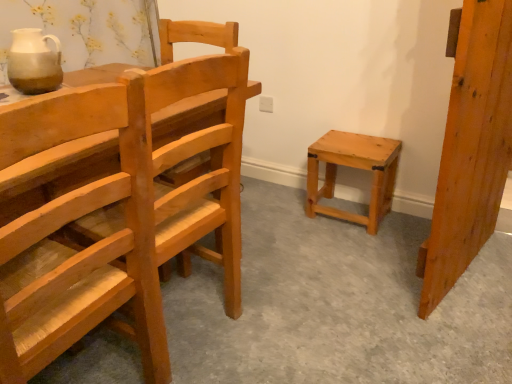
In order to click on free space that is to the left of natural wood stool at center-right in this screenshot , I will do 285,213.